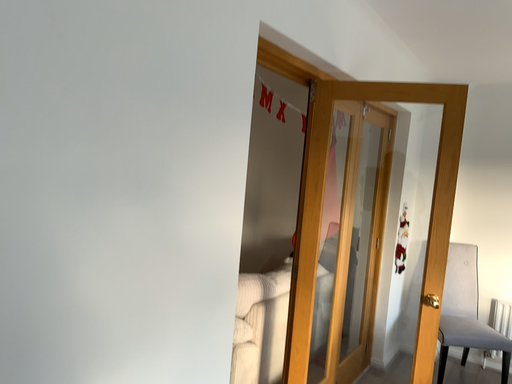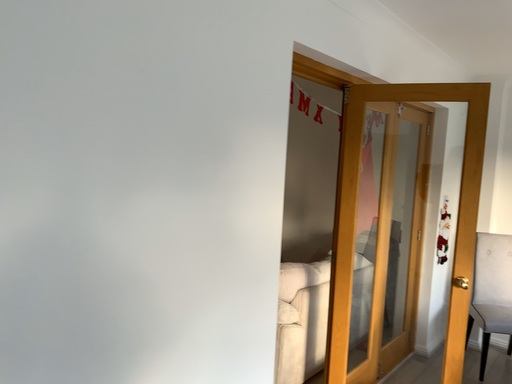
Question: Which way did the camera rotate in the video?

Choices:
 (A) rotated left
 (B) rotated right

Answer: (A)